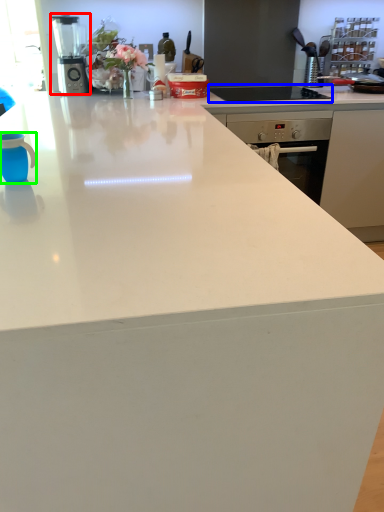
Question: Based on their relative distances, which object is nearer to kitchen appliance (highlighted by a red box)? Choose from gas stove (highlighted by a blue box) and mug (highlighted by a green box).

Choices:
 (A) gas stove
 (B) mug

Answer: (A)